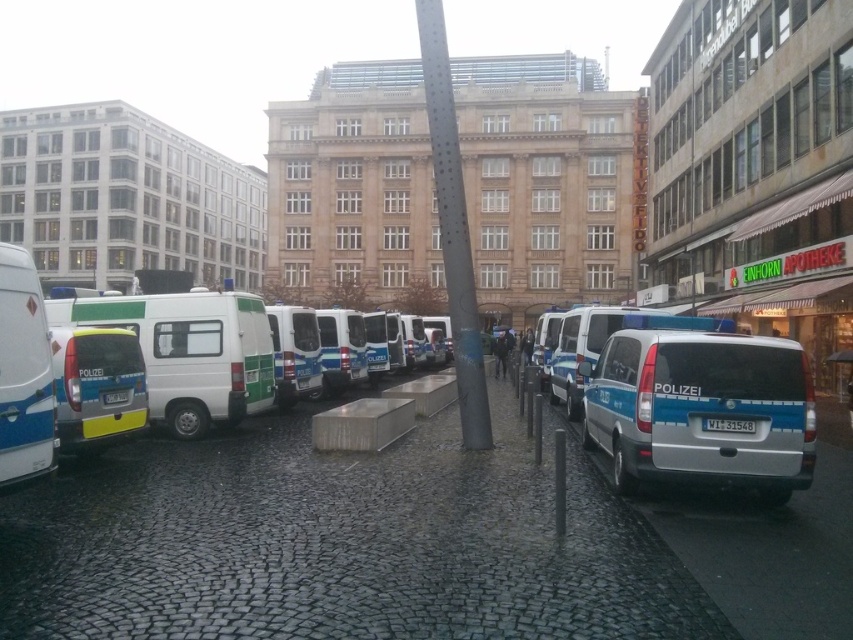
Question: Can you confirm if white matte van at center is positioned to the right of matte white van at left?

Choices:
 (A) no
 (B) yes

Answer: (A)

Question: Which of the following is the farthest from the observer?

Choices:
 (A) [x=236, y=592]
 (B) [x=792, y=460]
 (C) [x=187, y=346]

Answer: (C)

Question: Which point appears closest to the camera in this image?

Choices:
 (A) (21, 476)
 (B) (115, 525)
 (C) (721, 465)
 (D) (178, 328)

Answer: (A)

Question: Considering the real-world distances, which object is closest to the cobblestone pavement at center?

Choices:
 (A) matte white van at left
 (B) silver metallic van at right
 (C) white matte van at center

Answer: (B)

Question: Is silver metallic van at right thinner than white matte van at center?

Choices:
 (A) no
 (B) yes

Answer: (B)

Question: In this image, where is cobblestone pavement at center located relative to silver metallic van at right?

Choices:
 (A) below
 (B) above

Answer: (A)